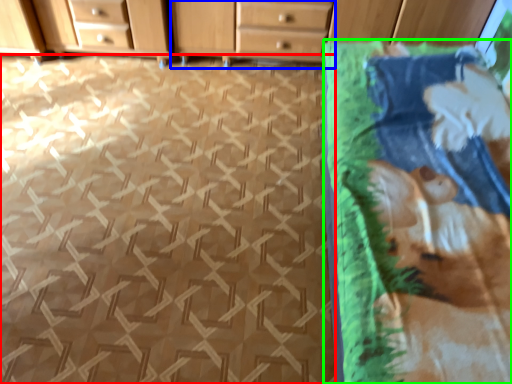
Question: Based on their relative distances, which object is farther from tile (highlighted by a red box)? Choose from chest of drawers (highlighted by a blue box) and blanket (highlighted by a green box).

Choices:
 (A) chest of drawers
 (B) blanket

Answer: (A)